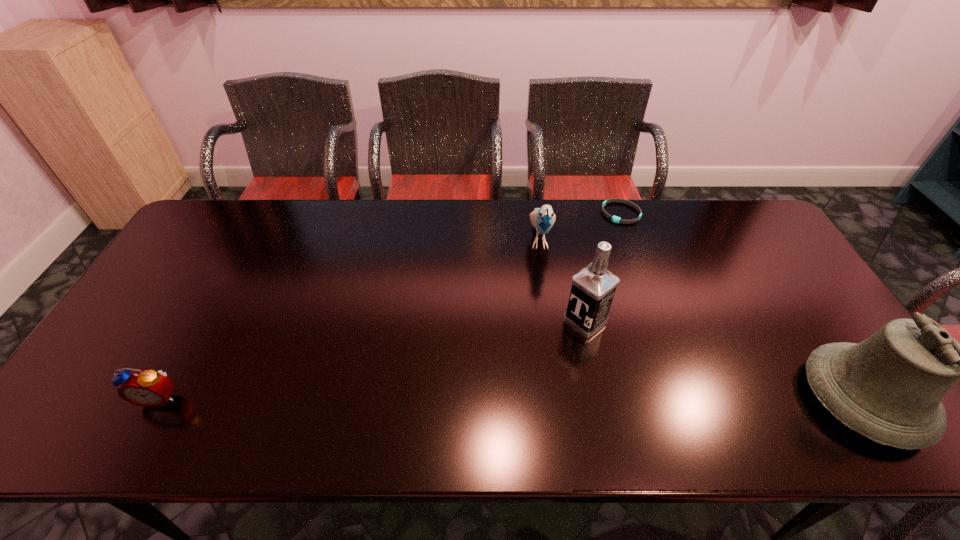
What are the coordinates of `the leftmost object` in the screenshot? It's located at (148, 388).

Find the location of a particular element. The height and width of the screenshot is (540, 960). the fourth tallest object is located at coordinates (148, 388).

Where is `the shortest object`? This screenshot has width=960, height=540. the shortest object is located at coordinates (615, 219).

The width and height of the screenshot is (960, 540). I want to click on wristband, so click(x=615, y=219).

Locate an element on the screen. the third shortest object is located at coordinates (543, 218).

Find the location of `vodka`. vodka is located at coordinates (593, 288).

You are a GUI agent. You are given a task and a screenshot of the screen. Output one action in this format:
    pyautogui.click(x=<x>, y=<y>)
    Task: Click on the free space located on the buckle of the second object from right to left
    
    Given the screenshot: What is the action you would take?
    pyautogui.click(x=596, y=284)

The image size is (960, 540). I want to click on vacant space situated on the buckle of the second object from right to left, so click(x=603, y=265).

This screenshot has height=540, width=960. I want to click on free spot located on the buckle of the second object from right to left, so click(603, 265).

At what (x,y) coordinates should I click in order to perform the action: click on free location located 0.110m at the face of the bird. Please return your answer as a coordinate pair (x, y). The image size is (960, 540). Looking at the image, I should click on (544, 294).